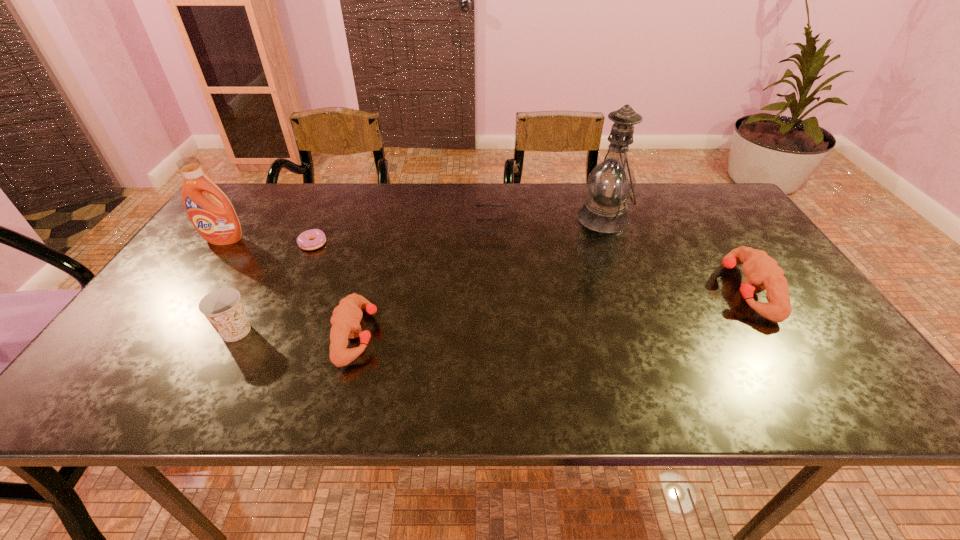
Locate an element on the screen. The image size is (960, 540). free space at the far edge of the desktop is located at coordinates (418, 210).

At what (x,y) coordinates should I click in order to perform the action: click on vacant space at the near edge of the desktop. Please return your answer as a coordinate pair (x, y). Image resolution: width=960 pixels, height=540 pixels. Looking at the image, I should click on (386, 341).

In the image, there is a desktop. Where is `free region at the left edge`? The height and width of the screenshot is (540, 960). free region at the left edge is located at coordinates (213, 258).

This screenshot has height=540, width=960. I want to click on vacant region at the right edge of the desktop, so click(828, 332).

I want to click on vacant region at the far left corner of the desktop, so click(x=260, y=202).

Where is `free space between the second object from left to right and the sixth shortest object`? The width and height of the screenshot is (960, 540). free space between the second object from left to right and the sixth shortest object is located at coordinates (230, 286).

Identify the location of empty space that is in between the Dixie cup and the shortest object. This screenshot has height=540, width=960. click(x=276, y=288).

The height and width of the screenshot is (540, 960). Identify the location of free space between the rightmost object and the sixth shortest object. (485, 265).

Where is `free spot between the fourth object from right to left and the sixth object from right to left`? This screenshot has height=540, width=960. free spot between the fourth object from right to left and the sixth object from right to left is located at coordinates (x=297, y=333).

The width and height of the screenshot is (960, 540). I want to click on vacant area that lies between the second tallest object and the Dixie cup, so click(x=230, y=286).